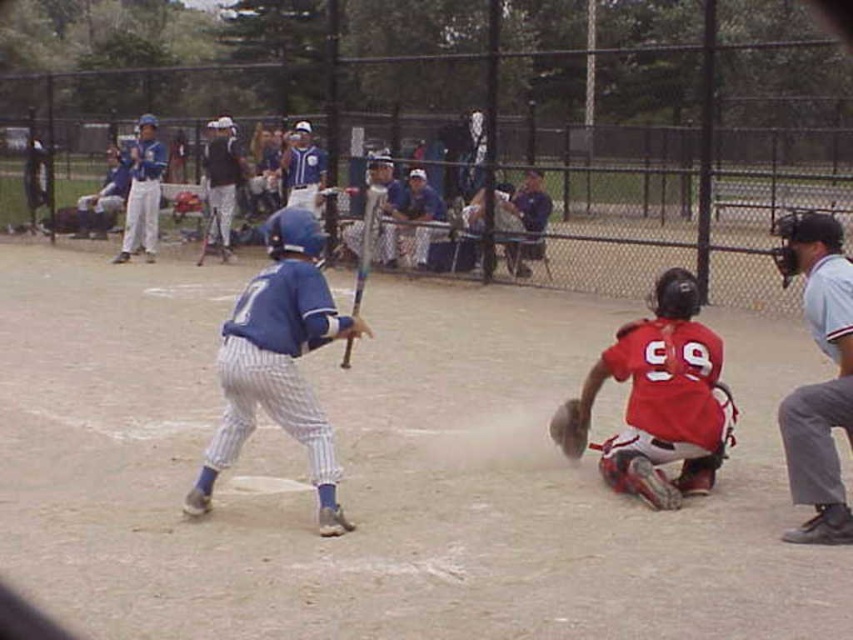
Question: Which object is closer to the camera taking this photo?

Choices:
 (A) blue plastic helmet at center
 (B) matte blue uniform at center

Answer: (A)

Question: Does white pinstriped uniform at upper center have a larger size compared to blue uniformed player at center?

Choices:
 (A) no
 (B) yes

Answer: (B)

Question: Can you confirm if gray fabric umpire at right is thinner than matte blue uniform at center?

Choices:
 (A) no
 (B) yes

Answer: (B)

Question: Observing the image, what is the correct spatial positioning of blue uniformed player at center in reference to brown leather glove at lower center?

Choices:
 (A) above
 (B) below

Answer: (A)

Question: Which object is positioned farthest from the metallic silver bat at center?

Choices:
 (A) matte blue uniform at center
 (B) blue uniformed player at center

Answer: (B)

Question: Which object is positioned farthest from the blue uniformed player at center?

Choices:
 (A) brown leather glove at lower center
 (B) blue matte baseball bat at center

Answer: (B)